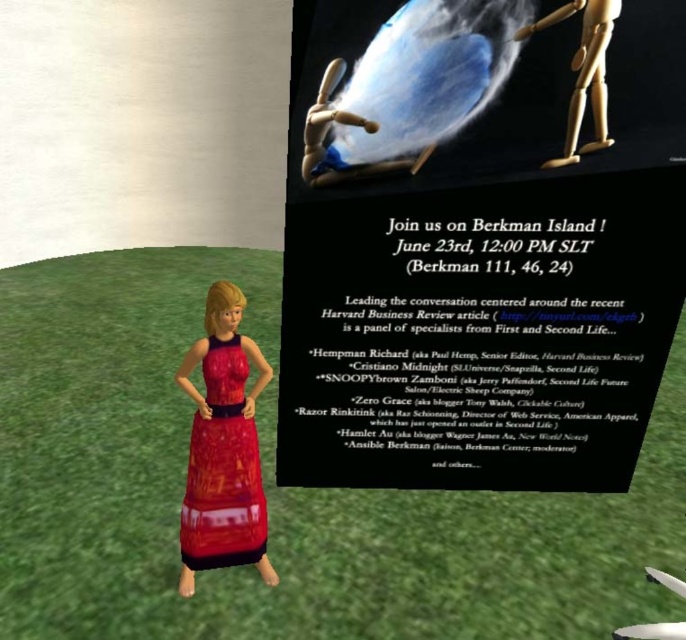
Question: Which object is the closest to the wooden figure at upper right?

Choices:
 (A) shiny red dress at lower left
 (B) wooden puppet at center
 (C) matte black poster at center

Answer: (B)

Question: Which object is positioned closest to the matte black poster at center?

Choices:
 (A) wooden puppet at center
 (B) shiny red dress at lower left
 (C) wooden figure at upper right

Answer: (C)

Question: Which point is farther from the camera taking this photo?

Choices:
 (A) (611, 19)
 (B) (237, 484)
 (C) (355, 177)

Answer: (B)

Question: Is shiny red dress at lower left to the right of wooden puppet at center from the viewer's perspective?

Choices:
 (A) yes
 (B) no

Answer: (B)

Question: Does matte black poster at center have a smaller size compared to wooden figure at upper right?

Choices:
 (A) yes
 (B) no

Answer: (B)

Question: Is matte black poster at center in front of wooden puppet at center?

Choices:
 (A) no
 (B) yes

Answer: (B)